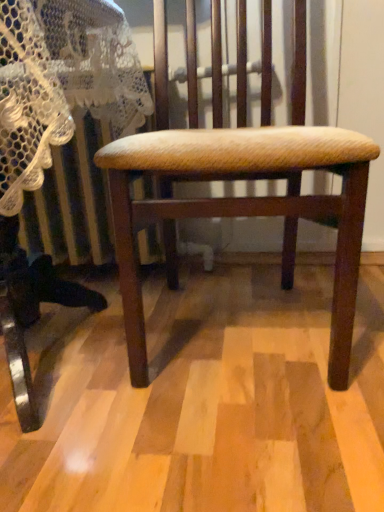
Question: In terms of width, does wooden chair at center look wider or thinner when compared to wooden textured stool at center?

Choices:
 (A) thin
 (B) wide

Answer: (A)

Question: From the image's perspective, is wooden chair at center positioned above or below wooden textured stool at center?

Choices:
 (A) below
 (B) above

Answer: (B)

Question: Is wooden chair at center taller or shorter than wooden textured stool at center?

Choices:
 (A) short
 (B) tall

Answer: (B)

Question: Is wooden textured stool at center situated inside wooden chair at center or outside?

Choices:
 (A) inside
 (B) outside

Answer: (B)

Question: In terms of width, does wooden textured stool at center look wider or thinner when compared to wooden chair at center?

Choices:
 (A) wide
 (B) thin

Answer: (A)

Question: Is wooden textured stool at center bigger or smaller than wooden chair at center?

Choices:
 (A) big
 (B) small

Answer: (A)

Question: Considering the positions of point [x=3, y=117] and point [x=354, y=253], is point [x=3, y=117] closer or farther from the camera than point [x=354, y=253]?

Choices:
 (A) closer
 (B) farther

Answer: (A)